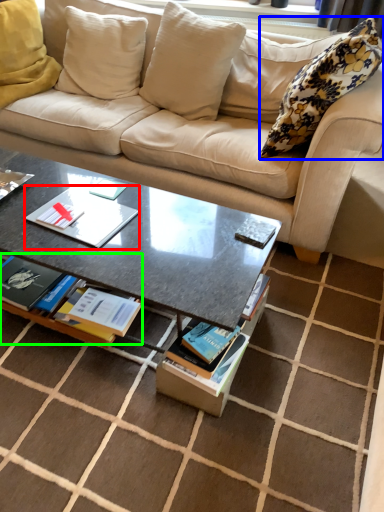
Question: Based on their relative distances, which object is nearer to paperback book (highlighted by a red box)? Choose from pillow (highlighted by a blue box) and book (highlighted by a green box).

Choices:
 (A) pillow
 (B) book

Answer: (B)